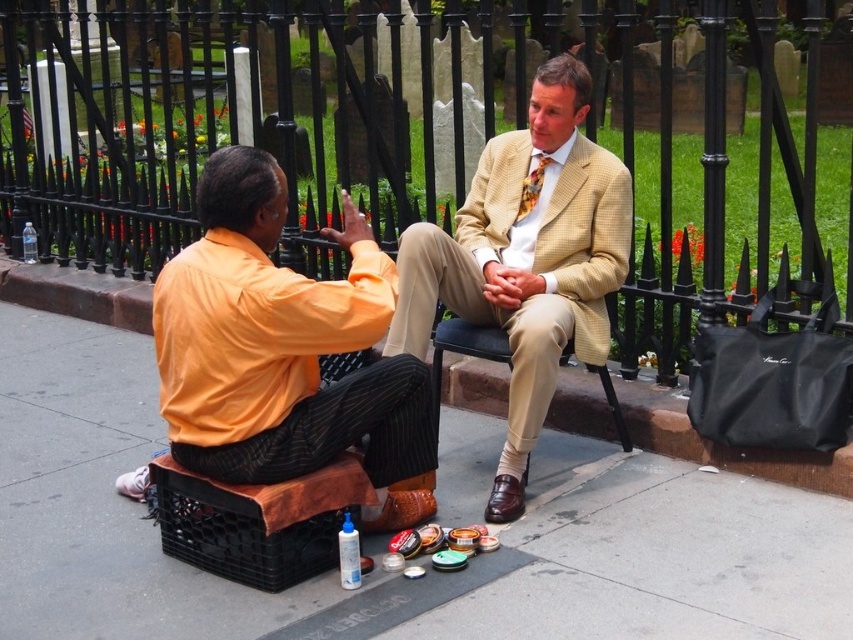
Can you confirm if brown leather shoe at lower center is bigger than light beige textured suit at center?

Yes.

Between brown leather shoe at lower center and light beige textured suit at center, which one is positioned higher?

light beige textured suit at center is higher up.

Where is `brown leather shoe at lower center`? This screenshot has height=640, width=853. brown leather shoe at lower center is located at coordinates (656, 556).

Does light beige textured suit at center have a lesser height compared to floral silk tie at center?

No.

What do you see at coordinates (525, 260) in the screenshot? I see `light beige textured suit at center` at bounding box center [525, 260].

Is point (433, 241) positioned in front of point (531, 192)?

Yes, point (433, 241) is in front of point (531, 192).

At what (x,y) coordinates should I click in order to perform the action: click on light beige textured suit at center. Please return your answer as a coordinate pair (x, y). The height and width of the screenshot is (640, 853). Looking at the image, I should click on (525, 260).

Between point (136, 548) and point (259, 461), which one is positioned behind?

The point (136, 548) is behind.

Which is behind, point (97, 372) or point (204, 330)?

Point (97, 372)

In order to click on brown leather shoe at lower center in this screenshot , I will do `click(656, 556)`.